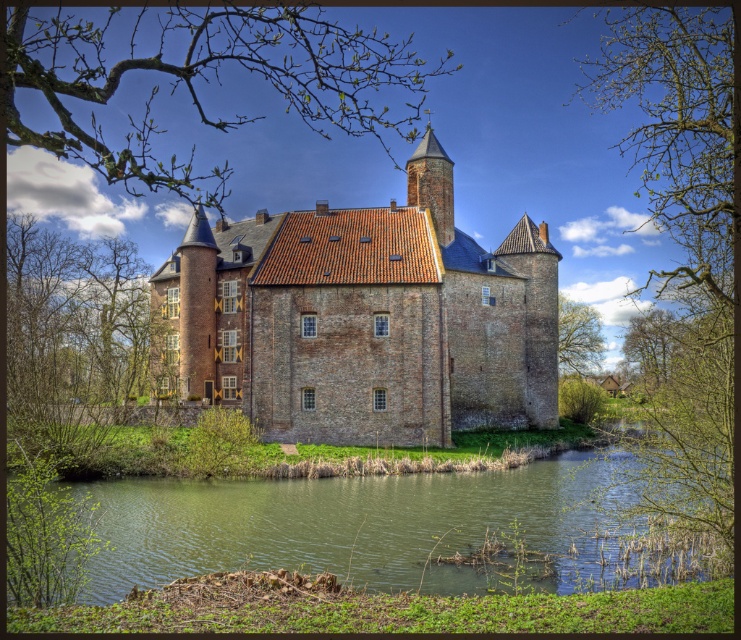
You are standing in front of the medieval castle and want to determine which of the two points, point (608, 516) or point (84, 358), is closer to you. Based on the castle structure and the surrounding landscape, which point is nearer?

Point (608, 516) is closer to the viewer than point (84, 358).